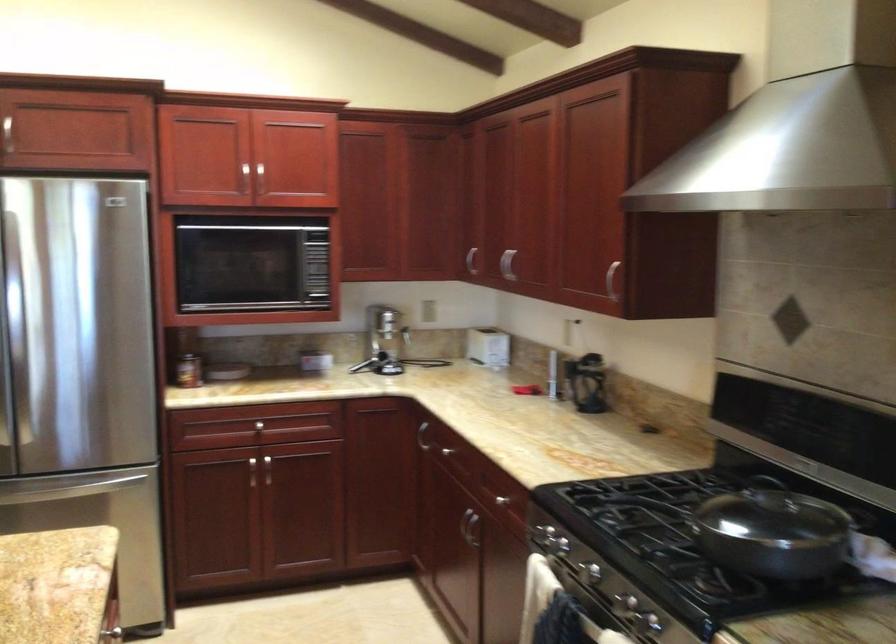
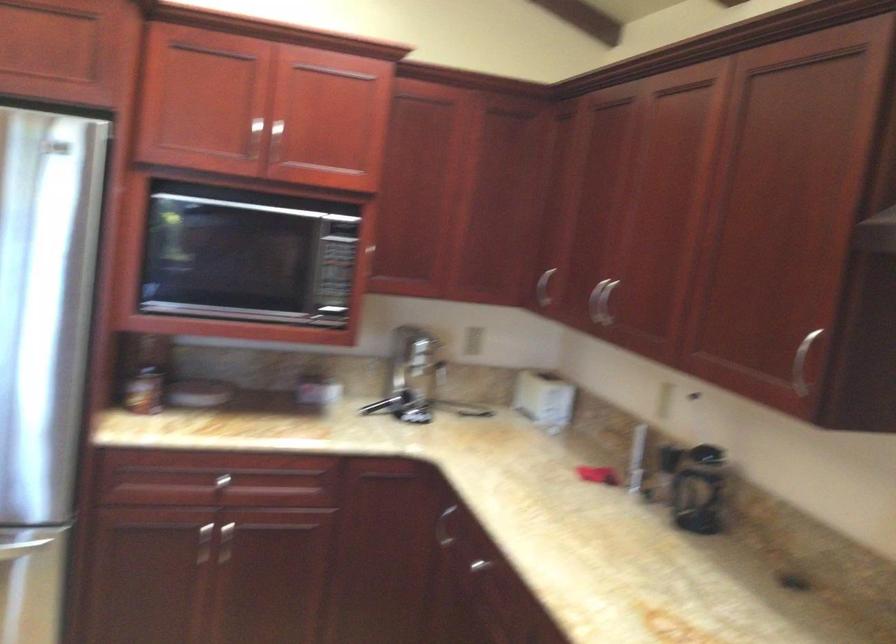
The point at (243, 178) is marked in the first image. Where is the corresponding point in the second image?

(254, 138)